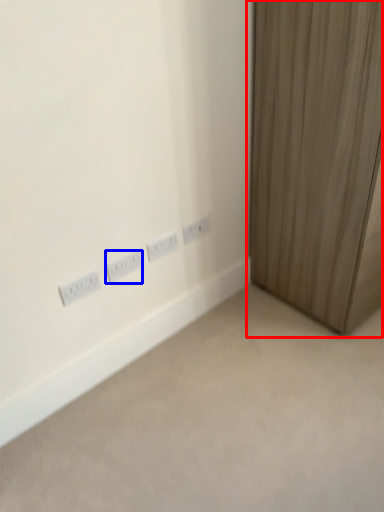
Question: Which point is further to the camera, curtain (highlighted by a red box) or power plugs and sockets (highlighted by a blue box)?

Choices:
 (A) curtain
 (B) power plugs and sockets

Answer: (B)